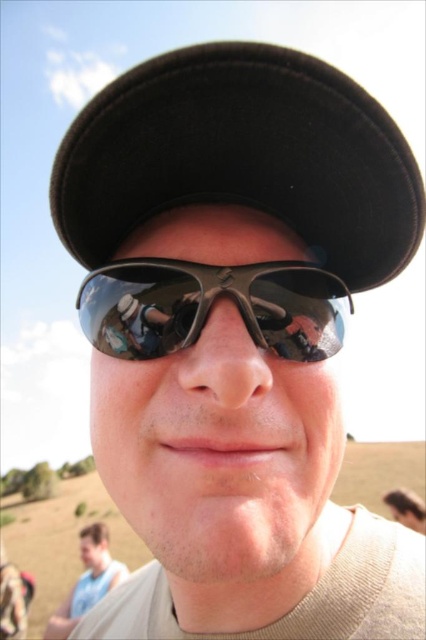
You are a fashion designer analyzing the image. You need to determine which item has a narrower width between the black felt baseball hat at upper center and the light blue shirt at lower left. Which one is narrower?

The black felt baseball hat at upper center has a lesser width compared to the light blue shirt at lower left, so the black felt baseball hat at upper center is narrower.

You are a photographer standing 20 inches away from the shiny black goggles at center. Can you capture a clear photo of them without any distortion?

The shiny black goggles at center and viewer are 20.90 inches apart, so yes, you can capture a clear photo of them without any distortion since the distance is sufficient.

Based on the scene description, which object is shorter in height between the black felt baseball hat at upper center and the light blue shirt at lower left?

The black felt baseball hat at upper center is shorter than the light blue shirt at lower left according to the description.